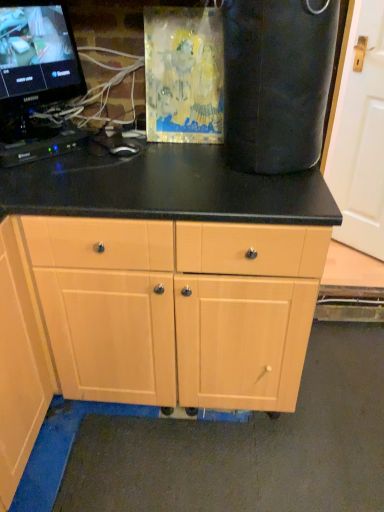
Question: From the image's perspective, would you say black plastic keyboard at left is shown under black glossy monitor at upper left?

Choices:
 (A) no
 (B) yes

Answer: (B)

Question: Is black plastic keyboard at left smaller than black glossy monitor at upper left?

Choices:
 (A) no
 (B) yes

Answer: (B)

Question: Is black plastic keyboard at left directly adjacent to black glossy monitor at upper left?

Choices:
 (A) yes
 (B) no

Answer: (B)

Question: Is black plastic keyboard at left far from black glossy monitor at upper left?

Choices:
 (A) yes
 (B) no

Answer: (B)

Question: From the image's perspective, is black plastic keyboard at left on top of black glossy monitor at upper left?

Choices:
 (A) yes
 (B) no

Answer: (B)

Question: Considering the relative positions of black glossy monitor at upper left and black plastic keyboard at left in the image provided, is black glossy monitor at upper left to the left or to the right of black plastic keyboard at left?

Choices:
 (A) right
 (B) left

Answer: (A)

Question: From the image's perspective, is black glossy monitor at upper left above or below black plastic keyboard at left?

Choices:
 (A) above
 (B) below

Answer: (A)

Question: Does point (31, 86) appear closer or farther from the camera than point (4, 150)?

Choices:
 (A) farther
 (B) closer

Answer: (A)

Question: Do you think black glossy monitor at upper left is within black plastic keyboard at left, or outside of it?

Choices:
 (A) inside
 (B) outside

Answer: (B)

Question: Based on their positions, is light wood cabinet at center located to the left or right of white matte door at right?

Choices:
 (A) left
 (B) right

Answer: (A)

Question: In terms of width, does light wood cabinet at center look wider or thinner when compared to white matte door at right?

Choices:
 (A) wide
 (B) thin

Answer: (A)

Question: Considering the positions of point (269, 259) and point (360, 231), is point (269, 259) closer or farther from the camera than point (360, 231)?

Choices:
 (A) closer
 (B) farther

Answer: (A)

Question: From a real-world perspective, is light wood cabinet at center physically located above or below white matte door at right?

Choices:
 (A) below
 (B) above

Answer: (A)

Question: Which is correct: light wood cabinet at center is inside black plastic keyboard at left, or outside of it?

Choices:
 (A) outside
 (B) inside

Answer: (A)

Question: Is point (87, 265) closer or farther from the camera than point (18, 147)?

Choices:
 (A) closer
 (B) farther

Answer: (A)